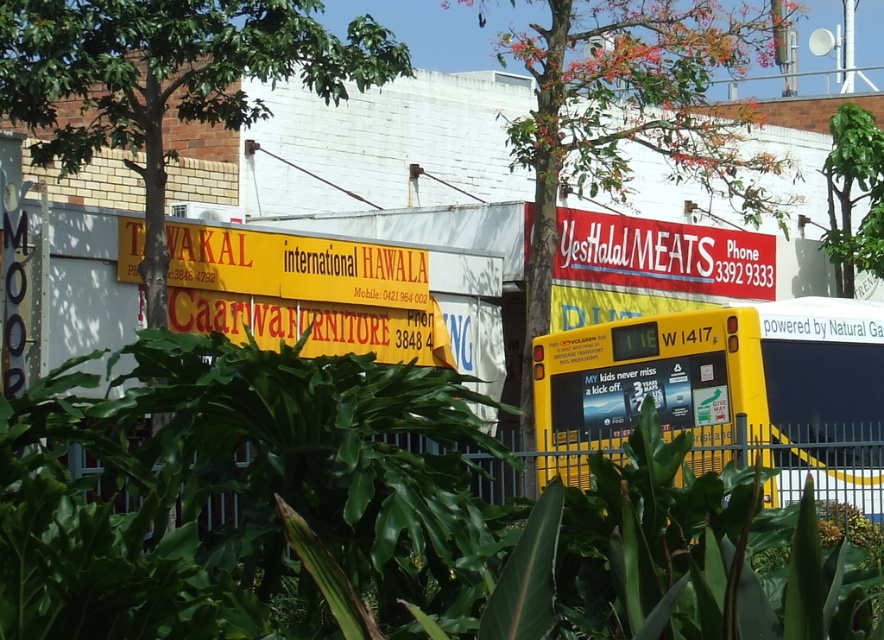
Does green leafy tree at upper left lie in front of green leafy tree at upper right?

Yes, it is.

Which is more to the left, green leafy tree at upper left or green leafy tree at upper right?

From the viewer's perspective, green leafy tree at upper left appears more on the left side.

Between point (199, 100) and point (856, 184), which one is positioned in front?

Point (199, 100) is in front.

Where is `green leafy tree at upper left`? The width and height of the screenshot is (884, 640). green leafy tree at upper left is located at coordinates (166, 81).

Does green leafy plants at center appear on the left side of green leafy tree at upper left?

In fact, green leafy plants at center is to the right of green leafy tree at upper left.

Does green leafy plants at center have a greater height compared to green leafy tree at upper left?

No, green leafy plants at center is not taller than green leafy tree at upper left.

Between point (379, 371) and point (117, 13), which one is positioned behind?

Positioned behind is point (117, 13).

This screenshot has height=640, width=884. I want to click on green leafy plants at center, so click(x=374, y=518).

Is green leafy tree at upper center closer to camera compared to green leafy tree at upper right?

Yes, it is.

Which is above, green leafy tree at upper center or green leafy tree at upper right?

green leafy tree at upper center is above.

Is point (547, 196) closer to viewer compared to point (850, 124)?

Yes, point (547, 196) is in front of point (850, 124).

The height and width of the screenshot is (640, 884). Find the location of `green leafy tree at upper center`. green leafy tree at upper center is located at coordinates point(629,115).